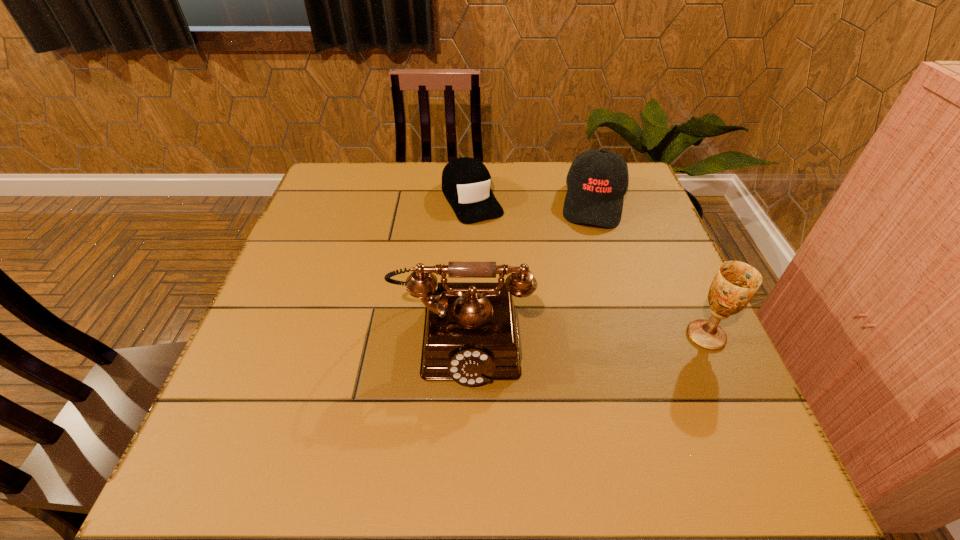
You are a GUI agent. You are given a task and a screenshot of the screen. Output one action in this format:
    pyautogui.click(x=<x>, y=<y>)
    Task: Click on the free location located on the front-facing side of the shortest object
    
    Given the screenshot: What is the action you would take?
    pyautogui.click(x=512, y=272)

The height and width of the screenshot is (540, 960). I want to click on vacant region located on the front-facing side of the baseball cap, so click(584, 340).

Locate an element on the screen. This screenshot has height=540, width=960. free region located 0.220m on the front-facing side of the baseball cap is located at coordinates (588, 289).

Where is `vacant space located 0.230m on the front-facing side of the baseball cap`? The height and width of the screenshot is (540, 960). vacant space located 0.230m on the front-facing side of the baseball cap is located at coordinates (588, 293).

In order to click on cap positioned at the far edge in this screenshot , I will do `click(466, 182)`.

Find the location of a particular element. This screenshot has width=960, height=540. baseball cap that is positioned at the far edge is located at coordinates pyautogui.click(x=597, y=180).

Where is `object that is positioned at the near edge`? object that is positioned at the near edge is located at coordinates (470, 336).

Identify the location of chalice positioned at the right edge. (735, 283).

The width and height of the screenshot is (960, 540). I want to click on baseball cap that is at the right edge, so click(597, 180).

Find the location of a particular element. object that is at the far right corner is located at coordinates (597, 180).